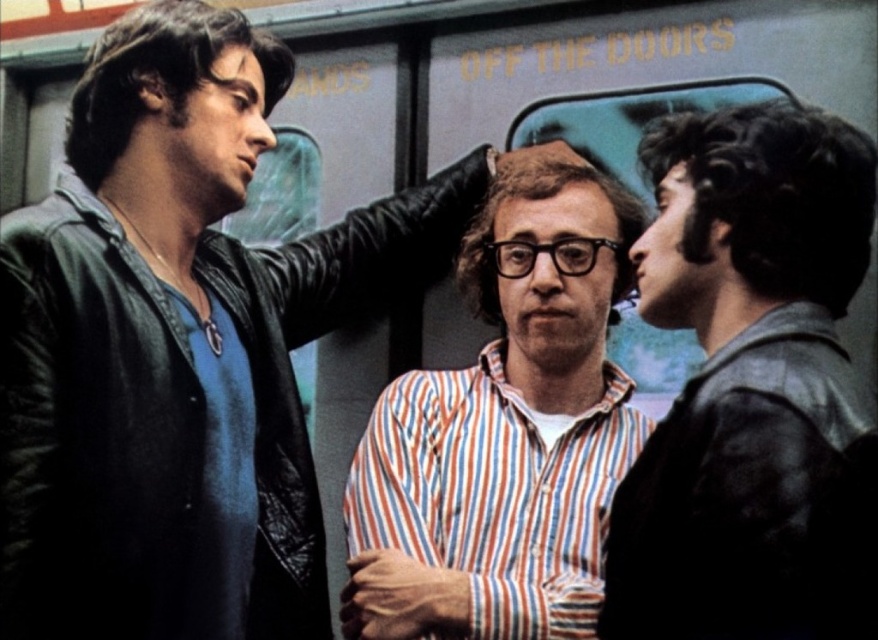
Between dark gray leather jacket at right and striped cotton shirt at center, which one appears on the left side from the viewer's perspective?

striped cotton shirt at center

Does dark gray leather jacket at right have a larger size compared to striped cotton shirt at center?

Yes, dark gray leather jacket at right is bigger than striped cotton shirt at center.

The image size is (878, 640). Describe the element at coordinates (752, 387) in the screenshot. I see `dark gray leather jacket at right` at that location.

This screenshot has height=640, width=878. I want to click on dark gray leather jacket at right, so click(x=752, y=387).

Can you confirm if matte black leather jacket at left is positioned below striped cotton shirt at center?

No.

Does matte black leather jacket at left have a greater height compared to striped cotton shirt at center?

Correct, matte black leather jacket at left is much taller as striped cotton shirt at center.

Locate an element on the screen. The image size is (878, 640). matte black leather jacket at left is located at coordinates (178, 348).

Does matte black leather jacket at left have a lesser width compared to dark gray leather jacket at right?

No.

Consider the image. Which is below, matte black leather jacket at left or dark gray leather jacket at right?

Positioned lower is dark gray leather jacket at right.

Who is more forward, (176,525) or (752,515)?

Point (752,515)

The image size is (878, 640). In order to click on matte black leather jacket at left in this screenshot , I will do `click(178, 348)`.